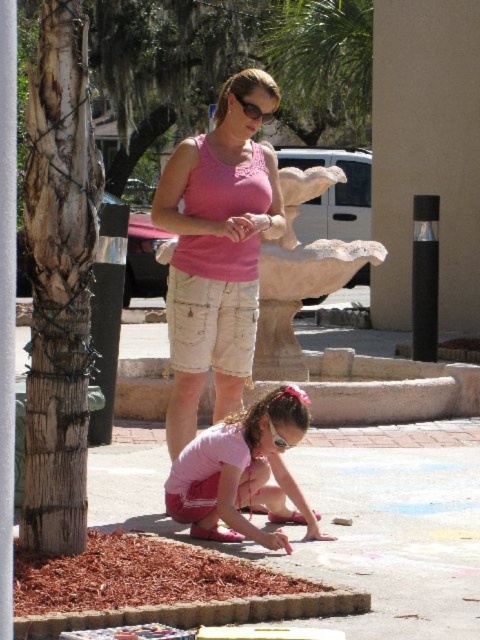
Does pink fabric shorts at lower center have a larger size compared to green leafy palm tree at upper center?

Incorrect, pink fabric shorts at lower center is not larger than green leafy palm tree at upper center.

Is point (231, 436) farther from camera compared to point (360, 74)?

No, it is in front of (360, 74).

You are a GUI agent. You are given a task and a screenshot of the screen. Output one action in this format:
    pyautogui.click(x=<x>, y=<y>)
    Task: Click on the pink fabric shorts at lower center
    The height and width of the screenshot is (640, 480).
    Given the screenshot: What is the action you would take?
    pyautogui.click(x=241, y=472)

Who is taller, pink cotton tank top at center or pink fabric shorts at lower center?

pink fabric shorts at lower center is taller.

Measure the distance between point (257, 148) and camera.

10.07 meters

At what (x,y) coordinates should I click in order to perform the action: click on pink cotton tank top at center. Please return your answer as a coordinate pair (x, y). The image size is (480, 640). Looking at the image, I should click on 217,250.

Is pink cotton tank top at center below green leafy palm tree at upper center?

Yes.

You are a GUI agent. You are given a task and a screenshot of the screen. Output one action in this format:
    pyautogui.click(x=<x>, y=<y>)
    Task: Click on the pink cotton tank top at center
    
    Given the screenshot: What is the action you would take?
    pyautogui.click(x=217, y=250)

Locate an element on the screen. pink cotton tank top at center is located at coordinates (217, 250).